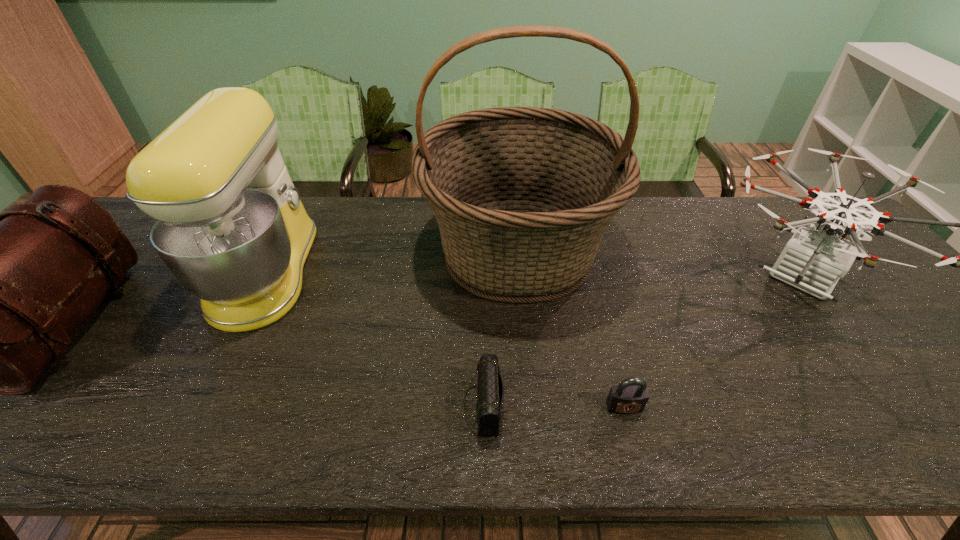
Identify the location of free space at the far edge of the desktop. Image resolution: width=960 pixels, height=540 pixels. (654, 198).

The width and height of the screenshot is (960, 540). Find the location of `blank space at the near edge`. blank space at the near edge is located at coordinates (504, 428).

You are a GUI agent. You are given a task and a screenshot of the screen. Output one action in this format:
    pyautogui.click(x=<x>, y=<y>)
    Task: Click on the empty location between the mixer and the clutch bag
    
    Given the screenshot: What is the action you would take?
    pyautogui.click(x=374, y=340)

Where is `vacant point located between the rightmost object and the padlock`? vacant point located between the rightmost object and the padlock is located at coordinates (712, 342).

Where is `vacant space that is in between the drone and the clutch bag`? vacant space that is in between the drone and the clutch bag is located at coordinates (641, 342).

Locate an element on the screen. vacant region between the drone and the padlock is located at coordinates (712, 342).

This screenshot has width=960, height=540. Identify the location of free spot between the rightmost object and the clutch bag. pos(641,342).

Find the location of a particular element. object that stands as the third closest to the leftmost object is located at coordinates (490, 394).

In order to click on object that is the second closest to the padlock in this screenshot , I will do `click(490, 394)`.

Where is `free space that satisfies the following two spatial constraints: 1. on the side of the rightmost object with the control knob; 2. on the left side of the mixer`? The width and height of the screenshot is (960, 540). free space that satisfies the following two spatial constraints: 1. on the side of the rightmost object with the control knob; 2. on the left side of the mixer is located at coordinates (264, 278).